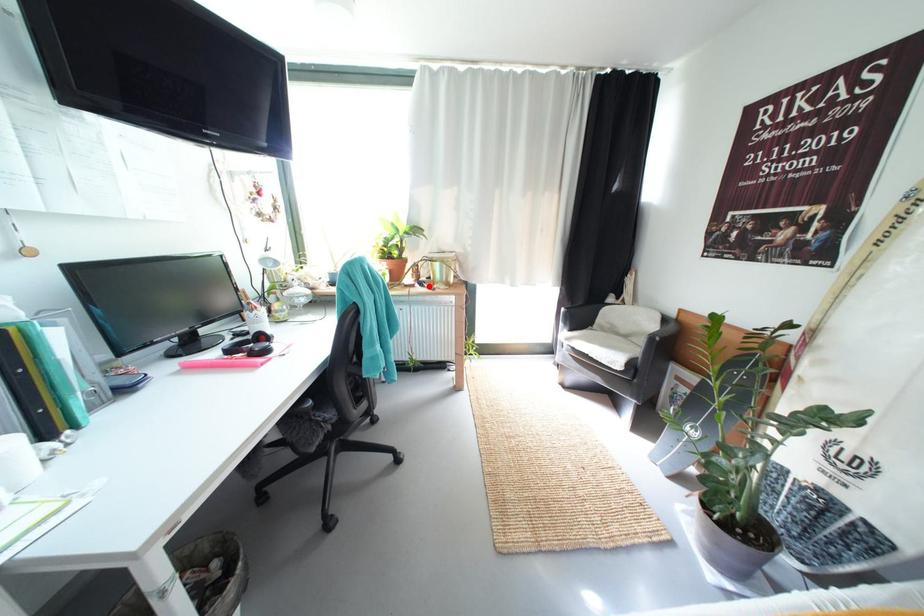
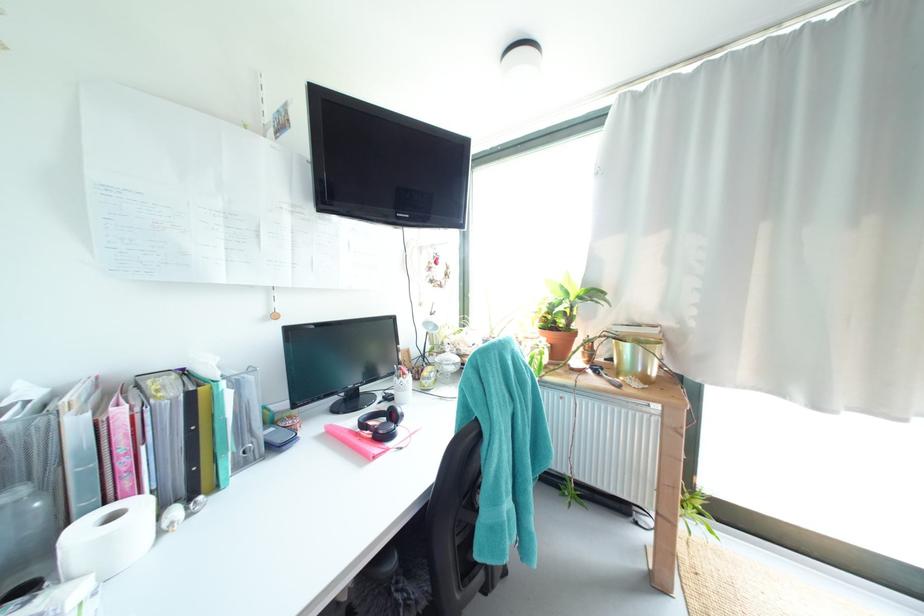
In the second image, find the point that corresponds to the highlighted location in the first image.

(603, 373)